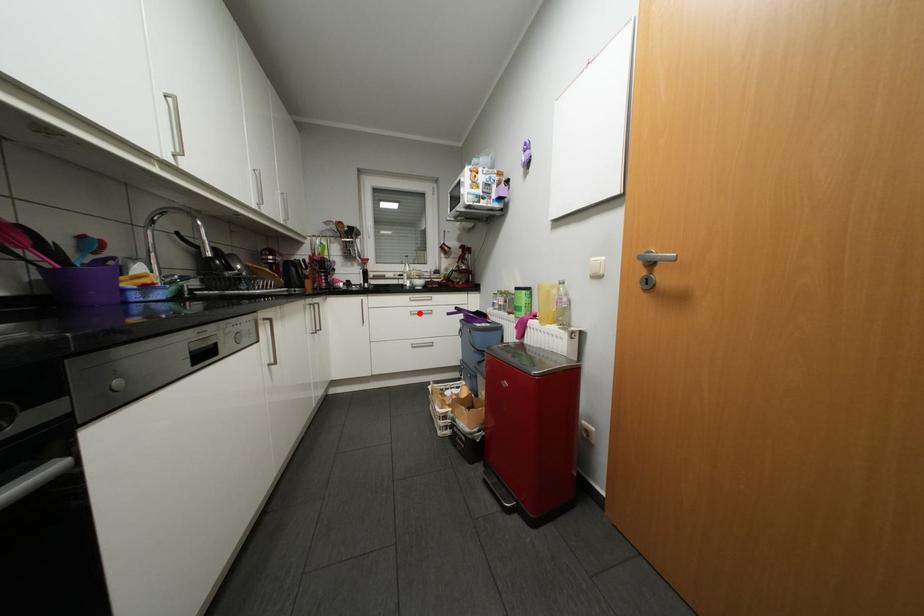
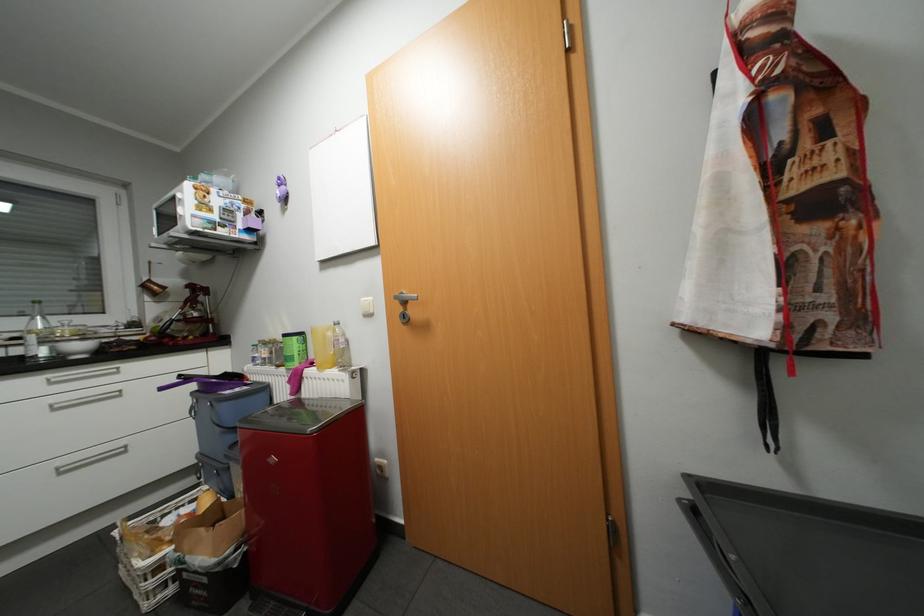
Locate, in the second image, the point that corresponds to the highlighted location in the first image.

(64, 408)